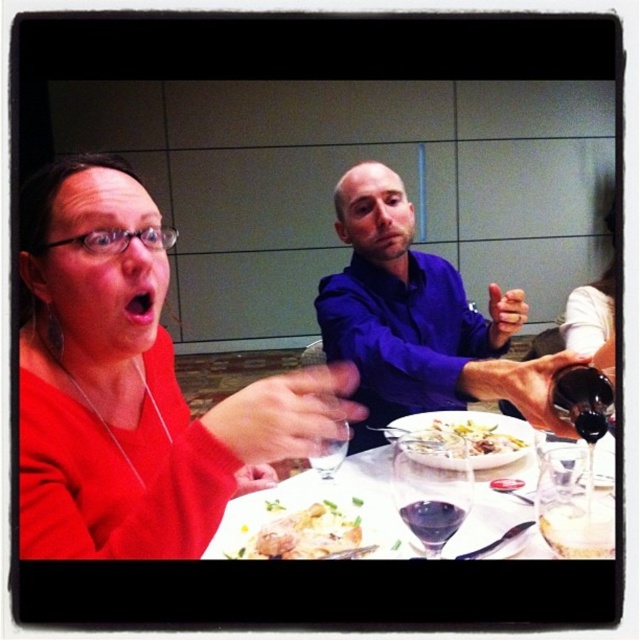
Is transparent glass wine glass at lower center below white creamy sauce at center?

No.

Which is below, transparent glass wine glass at lower center or white creamy sauce at center?

white creamy sauce at center is below.

Measure the distance between point (444, 484) and camera.

They are 29.17 inches apart.

The image size is (640, 640). I want to click on transparent glass wine glass at lower center, so click(x=432, y=486).

Which is in front, point (561, 406) or point (580, 435)?

Positioned in front is point (580, 435).

Locate an element on the screen. This screenshot has height=640, width=640. dark glass bottle at center right is located at coordinates (582, 400).

Who is more forward, (593,388) or (593,436)?

Point (593,436) is in front.

I want to click on dark glass bottle at center right, so click(582, 400).

Does point (577, 464) lie behind point (602, 433)?

Yes, it is behind point (602, 433).

Is point (582, 481) behind point (579, 420)?

Yes, point (582, 481) is behind point (579, 420).

In order to click on transparent glass at lower right in this screenshot , I will do `click(573, 502)`.